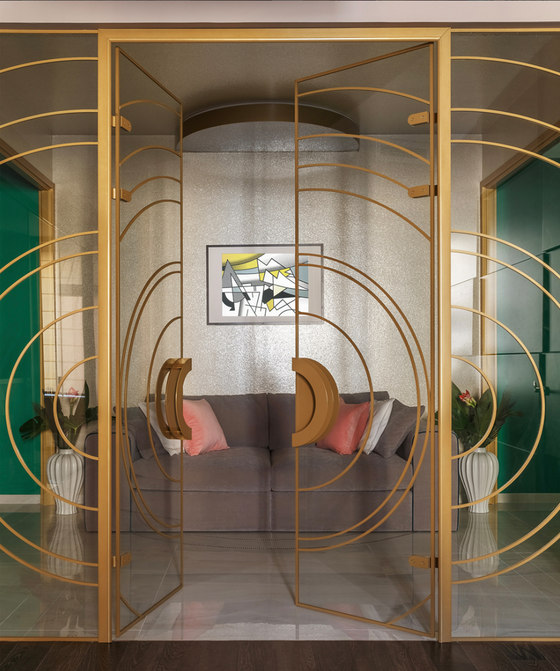
Find the location of a particular element. This screenshot has height=671, width=560. glass door is located at coordinates (380, 323), (172, 309).